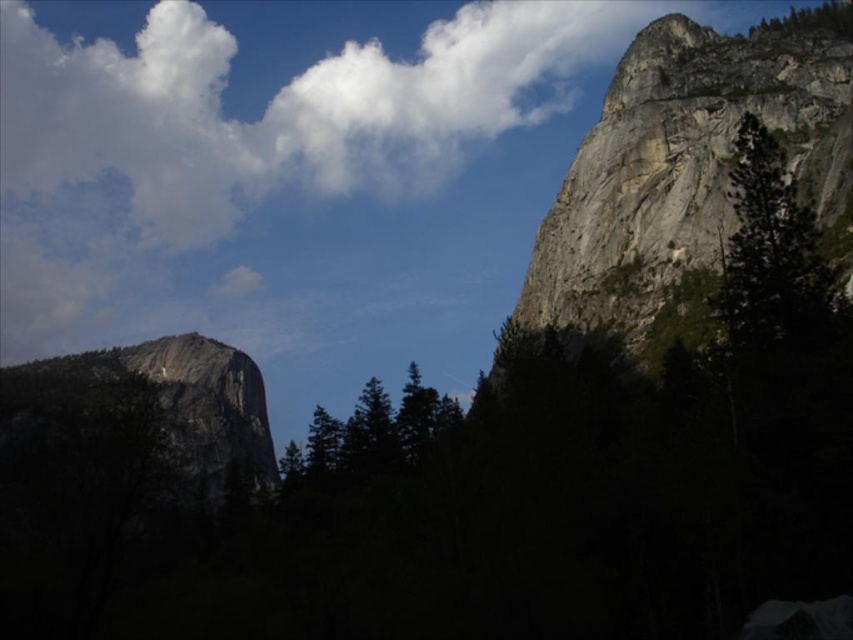
You are a hiker planning to take a photo of both the rocky cliff at upper right and the green textured tree at upper right from a position near the base of the cliff. Which object should you position closer to the center of your camera frame to ensure both are fully visible?

The rocky cliff at upper right is taller than the green textured tree at upper right, so you should position the rocky cliff at upper right closer to the center of your camera frame to ensure both are fully visible.

Consider the image. You are a photographer planning to capture the white fluffy cloud at upper center and the rugged granite mountain at left in a single shot. Considering their sizes, which object will appear bigger in the photo?

The white fluffy cloud at upper center will appear bigger in the photo because it is larger in size than the rugged granite mountain at left according to the description.